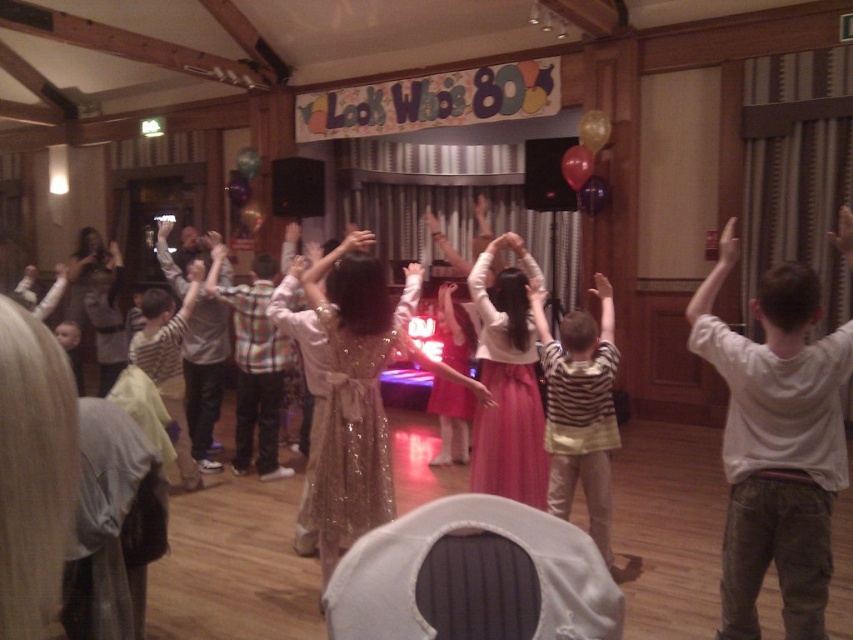
Question: Estimate the real-world distances between objects in this image. Which object is closer to the striped cotton shirt at center?

Choices:
 (A) translucent pink balloon at upper center
 (B) white cotton shirt at center
 (C) shiny pink dress at center

Answer: (B)

Question: Which of the following is the closest to the observer?

Choices:
 (A) white cotton shirt at center
 (B) shiny pink dress at center

Answer: (A)

Question: Does striped cotton shirt at center appear over shiny pink dress at center?

Choices:
 (A) yes
 (B) no

Answer: (B)

Question: Can you confirm if translucent pink balloon at upper center is positioned to the left of gold metallic balloon at upper center?

Choices:
 (A) no
 (B) yes

Answer: (B)

Question: Is striped cotton shirt at center smaller than gold metallic balloon at upper center?

Choices:
 (A) no
 (B) yes

Answer: (A)

Question: Which is nearer to the translucent pink balloon at upper center?

Choices:
 (A) white cotton shirt at center
 (B) translucent purple balloon at upper center
 (C) gold metallic balloon at upper center

Answer: (B)